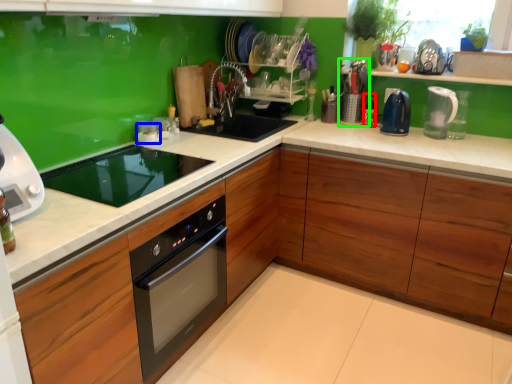
Question: Considering the real-world distances, which object is farthest from bottle (highlighted by a red box)? appliance (highlighted by a blue box) or appliance (highlighted by a green box)?

Choices:
 (A) appliance
 (B) appliance

Answer: (A)